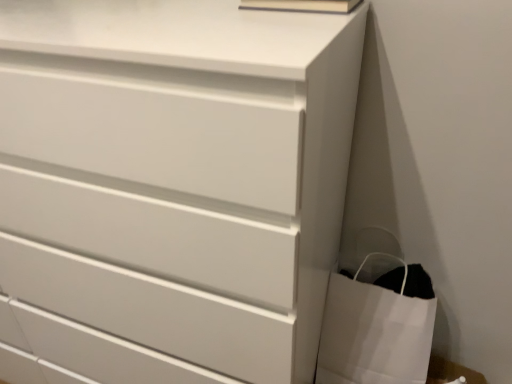
Question: Considering the relative sizes of white paper bag at lower right and white matte chest of drawers at center in the image provided, is white paper bag at lower right taller than white matte chest of drawers at center?

Choices:
 (A) no
 (B) yes

Answer: (A)

Question: Are white paper bag at lower right and white matte chest of drawers at center making contact?

Choices:
 (A) yes
 (B) no

Answer: (B)

Question: From the image's perspective, does white paper bag at lower right appear lower than white matte chest of drawers at center?

Choices:
 (A) yes
 (B) no

Answer: (A)

Question: Is white paper bag at lower right closer to the viewer compared to white matte chest of drawers at center?

Choices:
 (A) no
 (B) yes

Answer: (A)

Question: Does white paper bag at lower right come behind white matte chest of drawers at center?

Choices:
 (A) yes
 (B) no

Answer: (A)

Question: From a real-world perspective, does white paper bag at lower right stand above white matte chest of drawers at center?

Choices:
 (A) no
 (B) yes

Answer: (A)

Question: Is white paper bag at lower right located within white matte chest of drawers at center?

Choices:
 (A) no
 (B) yes

Answer: (A)

Question: Can you confirm if white matte chest of drawers at center is bigger than white paper bag at lower right?

Choices:
 (A) no
 (B) yes

Answer: (B)

Question: Is white matte chest of drawers at center oriented towards white paper bag at lower right?

Choices:
 (A) yes
 (B) no

Answer: (B)

Question: Is white matte chest of drawers at center closer to camera compared to white paper bag at lower right?

Choices:
 (A) yes
 (B) no

Answer: (A)

Question: Does white matte chest of drawers at center have a greater height compared to white paper bag at lower right?

Choices:
 (A) yes
 (B) no

Answer: (A)

Question: Considering the relative sizes of white matte chest of drawers at center and white paper bag at lower right in the image provided, is white matte chest of drawers at center smaller than white paper bag at lower right?

Choices:
 (A) no
 (B) yes

Answer: (A)

Question: Considering the positions of white paper bag at lower right and white matte chest of drawers at center in the image, is white paper bag at lower right wider or thinner than white matte chest of drawers at center?

Choices:
 (A) wide
 (B) thin

Answer: (B)